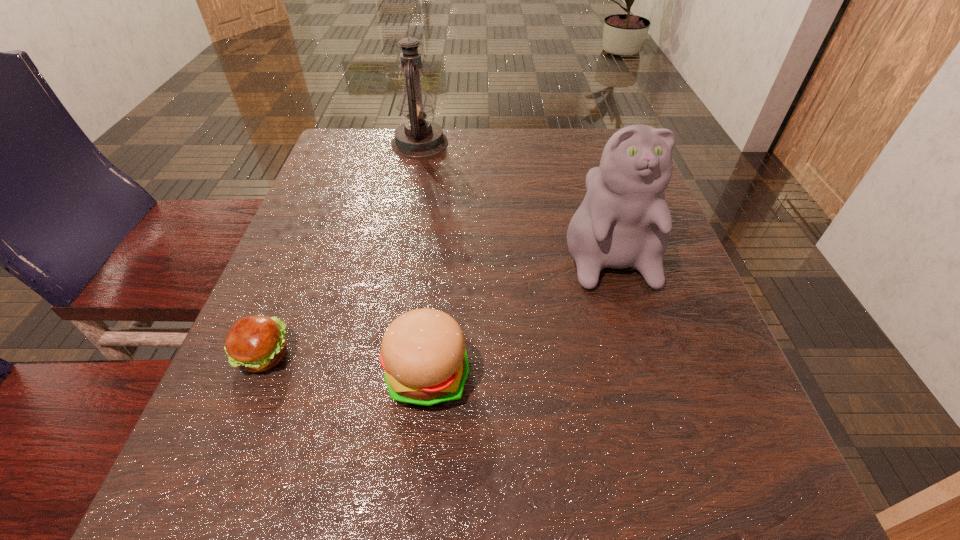
Find the location of a particular element. vacant space in between the right hamburger and the oil lamp is located at coordinates (423, 260).

Locate an element on the screen. vacant point located between the right hamburger and the leftmost object is located at coordinates (346, 366).

The height and width of the screenshot is (540, 960). I want to click on free spot between the rightmost object and the farthest object, so click(x=513, y=188).

Point out which object is positioned as the second nearest to the shortest object. Please provide its 2D coordinates. Your answer should be formatted as a tuple, i.e. [(x, y)], where the tuple contains the x and y coordinates of a point satisfying the conditions above.

[(624, 221)]

Identify which object is the closest to the farthest object. Please provide its 2D coordinates. Your answer should be formatted as a tuple, i.e. [(x, y)], where the tuple contains the x and y coordinates of a point satisfying the conditions above.

[(624, 221)]

The image size is (960, 540). I want to click on vacant space that satisfies the following two spatial constraints: 1. on the front side of the taller hamburger; 2. on the left side of the oil lamp, so click(x=376, y=376).

What are the coordinates of `vacant space that satisfies the following two spatial constraints: 1. on the front side of the taller hamburger; 2. on the right side of the shorter hamburger` in the screenshot? It's located at (255, 376).

Find the location of `vacant space that satisfies the following two spatial constraints: 1. on the front side of the leftmost object; 2. on the left side of the third tallest object`. vacant space that satisfies the following two spatial constraints: 1. on the front side of the leftmost object; 2. on the left side of the third tallest object is located at coordinates (255, 376).

You are a GUI agent. You are given a task and a screenshot of the screen. Output one action in this format:
    pyautogui.click(x=<x>, y=<y>)
    Task: Click on the free point that satisfies the following two spatial constraints: 1. on the front side of the right hamburger; 2. on the left side of the shorter hamburger
    The width and height of the screenshot is (960, 540).
    Given the screenshot: What is the action you would take?
    pyautogui.click(x=255, y=376)

Locate an element on the screen. Image resolution: width=960 pixels, height=540 pixels. free region that satisfies the following two spatial constraints: 1. on the front side of the oil lamp; 2. on the right side of the taller hamburger is located at coordinates (376, 376).